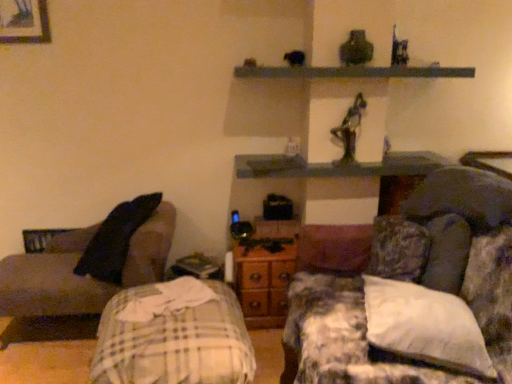
Question: Considering the relative positions of plaid fabric bed at lower left and smooth gray shelf at upper center, which is the second shelf from bottom to top, in the image provided, is plaid fabric bed at lower left to the right of smooth gray shelf at upper center, which is the second shelf from bottom to top, from the viewer's perspective?

Choices:
 (A) no
 (B) yes

Answer: (A)

Question: Considering the relative sizes of plaid fabric bed at lower left and smooth gray shelf at upper center, which is the second shelf from bottom to top, in the image provided, is plaid fabric bed at lower left bigger than smooth gray shelf at upper center, which is the second shelf from bottom to top,?

Choices:
 (A) no
 (B) yes

Answer: (B)

Question: Is plaid fabric bed at lower left positioned before smooth gray shelf at upper center, which is the second shelf from bottom to top?

Choices:
 (A) yes
 (B) no

Answer: (A)

Question: Is plaid fabric bed at lower left wider than smooth gray shelf at upper center, the 1th shelf positioned from the top?

Choices:
 (A) no
 (B) yes

Answer: (B)

Question: Can you confirm if plaid fabric bed at lower left is shorter than smooth gray shelf at upper center, the 1th shelf positioned from the top?

Choices:
 (A) yes
 (B) no

Answer: (B)

Question: Is plaid fabric bed at lower left at the left side of smooth gray shelf at upper center, the 1th shelf positioned from the top?

Choices:
 (A) yes
 (B) no

Answer: (A)

Question: Can you confirm if white soft pillow at right is thinner than smooth gray shelf at upper center, which is the second shelf from bottom to top?

Choices:
 (A) yes
 (B) no

Answer: (B)

Question: From a real-world perspective, is white soft pillow at right located beneath smooth gray shelf at upper center, which is the second shelf from bottom to top?

Choices:
 (A) yes
 (B) no

Answer: (A)

Question: Is the position of white soft pillow at right more distant than that of smooth gray shelf at upper center, which is the second shelf from bottom to top?

Choices:
 (A) no
 (B) yes

Answer: (A)

Question: From a real-world perspective, is white soft pillow at right on top of smooth gray shelf at upper center, the 1th shelf positioned from the top?

Choices:
 (A) yes
 (B) no

Answer: (B)

Question: From the image's perspective, is white soft pillow at right above smooth gray shelf at upper center, which is the second shelf from bottom to top?

Choices:
 (A) no
 (B) yes

Answer: (A)

Question: Is white soft pillow at right smaller than smooth gray shelf at upper center, the 1th shelf positioned from the top?

Choices:
 (A) yes
 (B) no

Answer: (A)

Question: Considering the relative sizes of fluffy fabric couch at right, arranged as the 1th studio couch when viewed from the right, and dark gray fabric couch at left, the 1th studio couch viewed from the left, in the image provided, is fluffy fabric couch at right, arranged as the 1th studio couch when viewed from the right, shorter than dark gray fabric couch at left, the 1th studio couch viewed from the left,?

Choices:
 (A) yes
 (B) no

Answer: (B)